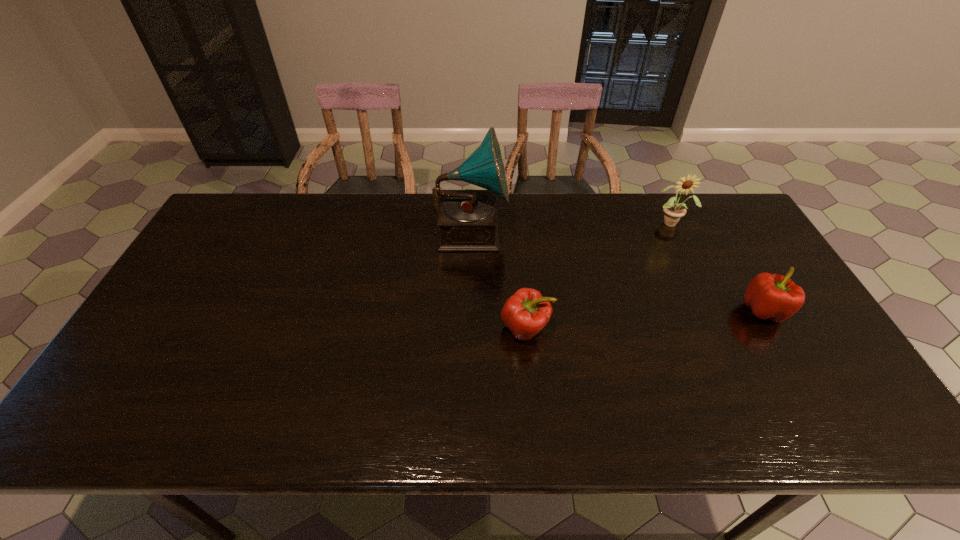
The image size is (960, 540). In order to click on sunflower that is at the far edge in this screenshot , I will do `click(673, 211)`.

This screenshot has width=960, height=540. I want to click on object that is at the right edge, so click(x=775, y=297).

This screenshot has width=960, height=540. What are the coordinates of `free space at the far edge` in the screenshot? It's located at (500, 204).

Locate an element on the screen. free space at the near edge of the desktop is located at coordinates (479, 423).

You are a GUI agent. You are given a task and a screenshot of the screen. Output one action in this format:
    pyautogui.click(x=<x>, y=<y>)
    Task: Click on the vacant space at the left edge
    The image size is (960, 540).
    Given the screenshot: What is the action you would take?
    pyautogui.click(x=194, y=315)

Image resolution: width=960 pixels, height=540 pixels. Identify the location of vacant space at the right edge of the desktop. (760, 261).

Image resolution: width=960 pixels, height=540 pixels. In order to click on vacant space at the far left corner in this screenshot , I will do `click(238, 204)`.

This screenshot has height=540, width=960. Identify the location of vacant area at the far right corner. (720, 211).

Image resolution: width=960 pixels, height=540 pixels. Find the location of `vacant space that's between the sunflower and the tallest object`. vacant space that's between the sunflower and the tallest object is located at coordinates (571, 226).

Locate an element on the screen. Image resolution: width=960 pixels, height=540 pixels. free point between the rightmost object and the sunflower is located at coordinates (718, 267).